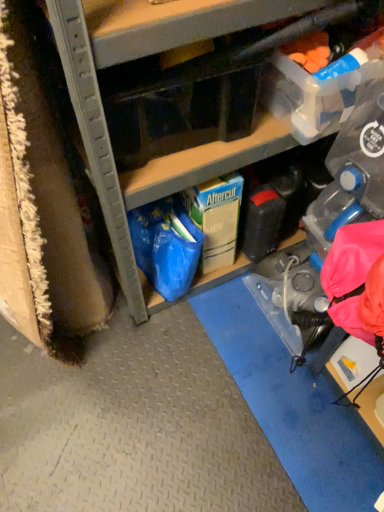
Question: Which direction should I rotate to look at transparent plastic storage box at upper center, which is counted as the first storage box, starting from the front, — up or down?

Choices:
 (A) up
 (B) down

Answer: (A)

Question: Considering the relative sizes of green cardboard box at center, the third storage box from the front, and translucent plastic storage box at upper right, the 2th storage box when ordered from back to front, in the image provided, is green cardboard box at center, the third storage box from the front, taller than translucent plastic storage box at upper right, the 2th storage box when ordered from back to front,?

Choices:
 (A) yes
 (B) no

Answer: (A)

Question: Is green cardboard box at center, the third storage box from the front, far from translucent plastic storage box at upper right, the 2th storage box when ordered from back to front?

Choices:
 (A) yes
 (B) no

Answer: (B)

Question: Is green cardboard box at center, the first storage box positioned from the back, to the right of translucent plastic storage box at upper right, arranged as the second storage box when viewed from the front, from the viewer's perspective?

Choices:
 (A) yes
 (B) no

Answer: (B)

Question: Are green cardboard box at center, the first storage box positioned from the back, and translucent plastic storage box at upper right, arranged as the second storage box when viewed from the front, beside each other?

Choices:
 (A) yes
 (B) no

Answer: (B)

Question: Is green cardboard box at center, the first storage box positioned from the back, positioned before translucent plastic storage box at upper right, arranged as the second storage box when viewed from the front?

Choices:
 (A) yes
 (B) no

Answer: (B)

Question: Is green cardboard box at center, the third storage box from the front, facing away from translucent plastic storage box at upper right, arranged as the second storage box when viewed from the front?

Choices:
 (A) no
 (B) yes

Answer: (A)

Question: Considering the relative positions of translucent plastic storage box at upper right, arranged as the second storage box when viewed from the front, and matte cardboard box at center in the image provided, is translucent plastic storage box at upper right, arranged as the second storage box when viewed from the front, in front of matte cardboard box at center?

Choices:
 (A) no
 (B) yes

Answer: (A)

Question: From the image's perspective, is translucent plastic storage box at upper right, arranged as the second storage box when viewed from the front, above matte cardboard box at center?

Choices:
 (A) no
 (B) yes

Answer: (A)

Question: Is translucent plastic storage box at upper right, the 2th storage box when ordered from back to front, completely or partially outside of matte cardboard box at center?

Choices:
 (A) yes
 (B) no

Answer: (A)

Question: Is translucent plastic storage box at upper right, arranged as the second storage box when viewed from the front, next to matte cardboard box at center and touching it?

Choices:
 (A) yes
 (B) no

Answer: (B)

Question: From the image's perspective, is translucent plastic storage box at upper right, the 2th storage box when ordered from back to front, under matte cardboard box at center?

Choices:
 (A) yes
 (B) no

Answer: (A)

Question: Is translucent plastic storage box at upper right, arranged as the second storage box when viewed from the front, thinner than matte cardboard box at center?

Choices:
 (A) yes
 (B) no

Answer: (A)

Question: Can you confirm if green cardboard box at center, the third storage box from the front, is positioned to the left of matte cardboard box at center?

Choices:
 (A) yes
 (B) no

Answer: (A)